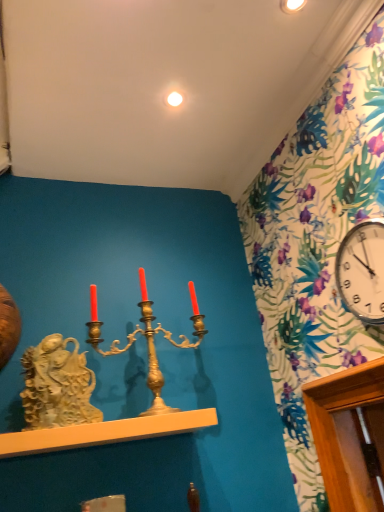
Find the location of a particular element. smooth white shelf at center is located at coordinates (104, 432).

Looking at this image, measure the distance between point (124,436) and camera.

The depth of point (124,436) is 1.31 meters.

Locate an element on the screen. The width and height of the screenshot is (384, 512). gold metallic candle holder at center is located at coordinates pyautogui.click(x=147, y=340).

Describe the element at coordinates (174, 99) in the screenshot. The width and height of the screenshot is (384, 512). I see `white glossy light bulb at upper center` at that location.

The height and width of the screenshot is (512, 384). I want to click on smooth white shelf at center, so click(104, 432).

Image resolution: width=384 pixels, height=512 pixels. Identify the location of shelf below the white glossy light bulb at upper center (from the image's perspective). (104, 432).

Which is more distant, (45, 439) or (179, 93)?

The point (179, 93) is farther.

Considering the relative positions of smooth white shelf at center and white glossy light bulb at upper center in the image provided, is smooth white shelf at center to the left or to the right of white glossy light bulb at upper center?

In the image, smooth white shelf at center appears on the left side of white glossy light bulb at upper center.

Is smooth white shelf at center aimed at white glossy light bulb at upper center?

No, smooth white shelf at center does not turn towards white glossy light bulb at upper center.

You are a GUI agent. You are given a task and a screenshot of the screen. Output one action in this format:
    pyautogui.click(x=<x>, y=<y>)
    Task: Click on the light on the right of smooth white shelf at center
    This screenshot has height=512, width=384.
    Given the screenshot: What is the action you would take?
    pyautogui.click(x=174, y=99)

Looking at their sizes, would you say white glossy light bulb at upper center is wider or thinner than smooth white shelf at center?

Clearly, white glossy light bulb at upper center has less width compared to smooth white shelf at center.

In the image, is white glossy light bulb at upper center positioned in front of or behind smooth white shelf at center?

In the image, white glossy light bulb at upper center appears behind smooth white shelf at center.

Is white glossy light bulb at upper center positioned with its back to smooth white shelf at center?

No, white glossy light bulb at upper center is not facing away from smooth white shelf at center.

How many degrees apart are the facing directions of white glossy clock at upper right and gold metallic candle holder at center?

white glossy clock at upper right and gold metallic candle holder at center are facing 88.2 degrees away from each other.

Where is `clock that is above the gold metallic candle holder at center (from the image's perspective)`? clock that is above the gold metallic candle holder at center (from the image's perspective) is located at coordinates (362, 271).

From the image's perspective, is white glossy clock at upper right positioned above or below gold metallic candle holder at center?

white glossy clock at upper right is situated higher than gold metallic candle holder at center in the image.

Considering the points (354, 259) and (176, 410), which point is in front, point (354, 259) or point (176, 410)?

The point (354, 259) is closer to the camera.

Looking at this image, is white glossy clock at upper right outside of smooth white shelf at center?

white glossy clock at upper right lies outside smooth white shelf at center's area.

Is point (344, 282) positioned before point (51, 433)?

No, it is not.

Measure the distance from white glossy clock at upper right to smooth white shelf at center.

The distance of white glossy clock at upper right from smooth white shelf at center is 30.13 inches.

Who is smaller, white glossy clock at upper right or smooth white shelf at center?

white glossy clock at upper right.

Can you see smooth white shelf at center touching gold metallic candle holder at center?

smooth white shelf at center and gold metallic candle holder at center are not in contact.

Can you confirm if smooth white shelf at center is bigger than gold metallic candle holder at center?

No.

Is smooth white shelf at center further to the viewer compared to gold metallic candle holder at center?

No.

This screenshot has height=512, width=384. In order to click on sculpture located in front of the gold metallic candle holder at center in this screenshot , I will do [57, 385].

Does point (160, 375) come behind point (82, 408)?

That is True.

Considering the positions of objects gold metallic candle holder at center and white stone sculpture at left in the image provided, who is more to the left, gold metallic candle holder at center or white stone sculpture at left?

white stone sculpture at left.

How many degrees apart are the facing directions of white glossy light bulb at upper center and white glossy clock at upper right?

The angle between the facing direction of white glossy light bulb at upper center and the facing direction of white glossy clock at upper right is 86.7 degrees.

Based on the photo, from the image's perspective, is white glossy light bulb at upper center above white glossy clock at upper right?

Indeed, from the image's perspective, white glossy light bulb at upper center is shown above white glossy clock at upper right.

From a real-world perspective, does white glossy light bulb at upper center stand above white glossy clock at upper right?

Yes, from a real-world perspective, white glossy light bulb at upper center is above white glossy clock at upper right.

Is white glossy light bulb at upper center turned away from white glossy clock at upper right?

white glossy light bulb at upper center does not have its back to white glossy clock at upper right.

There is a smooth white shelf at center. At what (x,y) coordinates should I click in order to perform the action: click on light above it (from a real-world perspective). Please return your answer as a coordinate pair (x, y). Looking at the image, I should click on (174, 99).

The width and height of the screenshot is (384, 512). I want to click on shelf on the left of white glossy light bulb at upper center, so click(x=104, y=432).

Based on their spatial positions, is smooth white shelf at center or white glossy light bulb at upper center further from white glossy clock at upper right?

white glossy light bulb at upper center is positioned further to the anchor white glossy clock at upper right.

Which object lies nearer to the anchor point gold metallic candle holder at center, white glossy clock at upper right or smooth white shelf at center?

smooth white shelf at center.

Estimate the real-world distances between objects in this image. Which object is further from white stone sculpture at left, smooth white shelf at center or white glossy clock at upper right?

white glossy clock at upper right is positioned further to the anchor white stone sculpture at left.

Estimate the real-world distances between objects in this image. Which object is further from smooth white shelf at center, white glossy light bulb at upper center or white glossy clock at upper right?

The object further to smooth white shelf at center is white glossy light bulb at upper center.

Looking at the image, which one is located closer to gold metallic candle holder at center, white glossy light bulb at upper center or white glossy clock at upper right?

white glossy clock at upper right.

Which object lies further to the anchor point white glossy clock at upper right, smooth white shelf at center or white stone sculpture at left?

white stone sculpture at left.

When comparing their distances from white stone sculpture at left, does white glossy clock at upper right or gold metallic candle holder at center seem closer?

gold metallic candle holder at center lies closer to white stone sculpture at left than the other object.

From the image, which object appears to be nearer to white stone sculpture at left, white glossy light bulb at upper center or gold metallic candle holder at center?

gold metallic candle holder at center is closer to white stone sculpture at left.

Find the location of a particular element. This screenshot has height=512, width=384. shelf between white stone sculpture at left and white glossy clock at upper right is located at coordinates 104,432.

Where is `clock between white glossy light bulb at upper center and smooth white shelf at center from top to bottom`? clock between white glossy light bulb at upper center and smooth white shelf at center from top to bottom is located at coordinates (362, 271).

Where is `clock between white glossy light bulb at upper center and white stone sculpture at left in the up-down direction`? This screenshot has height=512, width=384. clock between white glossy light bulb at upper center and white stone sculpture at left in the up-down direction is located at coordinates (362, 271).

What are the coordinates of `sculpture that lies between gold metallic candle holder at center and smooth white shelf at center from top to bottom` in the screenshot? It's located at pos(57,385).